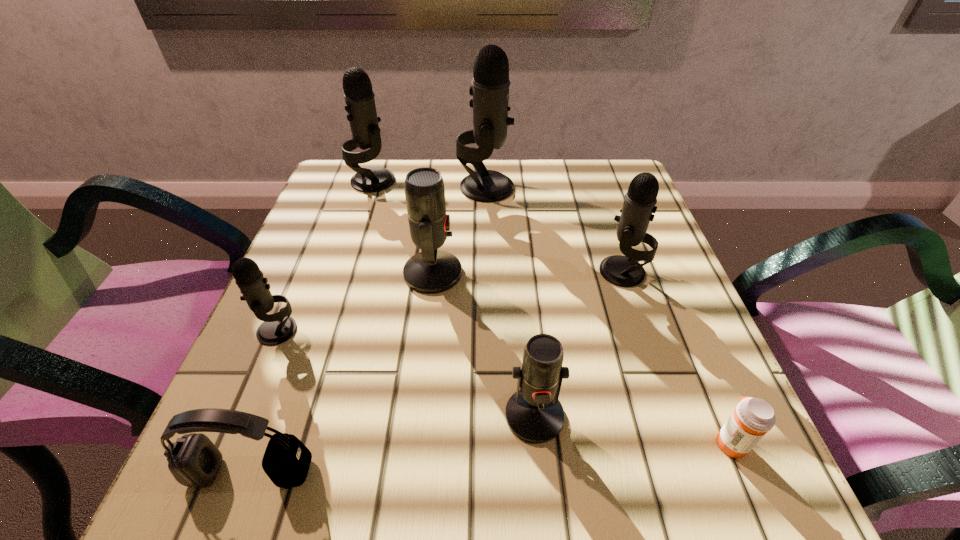
The height and width of the screenshot is (540, 960). What are the coordinates of `black microphone that is the second nearest to the left red microphone` in the screenshot? It's located at (490, 90).

Locate which black microphone is the closest to the tallest object. Please provide its 2D coordinates. Your answer should be formatted as a tuple, i.e. [(x, y)], where the tuple contains the x and y coordinates of a point satisfying the conditions above.

[(360, 105)]